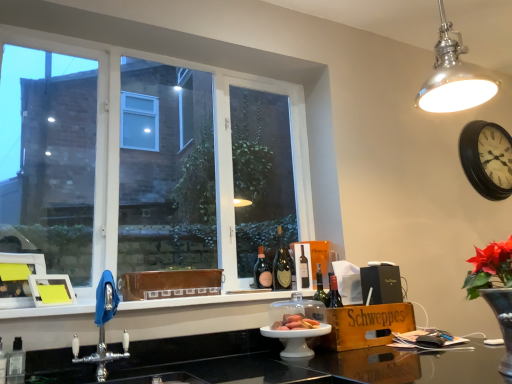
Question: From a real-world perspective, is black wooden clock at upper right positioned above or below shiny gold bottle at center, placed as the second bottle when sorted from left to right?

Choices:
 (A) below
 (B) above

Answer: (B)

Question: Considering the positions of point (461, 157) and point (275, 253), is point (461, 157) closer or farther from the camera than point (275, 253)?

Choices:
 (A) closer
 (B) farther

Answer: (A)

Question: Considering the real-world distances, which object is closest to the matte glass bottle at center, the 1th bottle in the left-to-right sequence?

Choices:
 (A) white glossy window sill at lower center
 (B) matte brown bread at center
 (C) chrome metallic tap at lower left
 (D) polished metal light fixture at upper right
 (E) white plastic window at left

Answer: (B)

Question: Which object is positioned closest to the wooden box at lower right?

Choices:
 (A) shiny gold bottle at center, the 1th bottle when ordered from right to left
 (B) polished metal light fixture at upper right
 (C) chrome metallic tap at lower left
 (D) black wooden clock at upper right
 (E) white glossy window sill at lower center

Answer: (E)